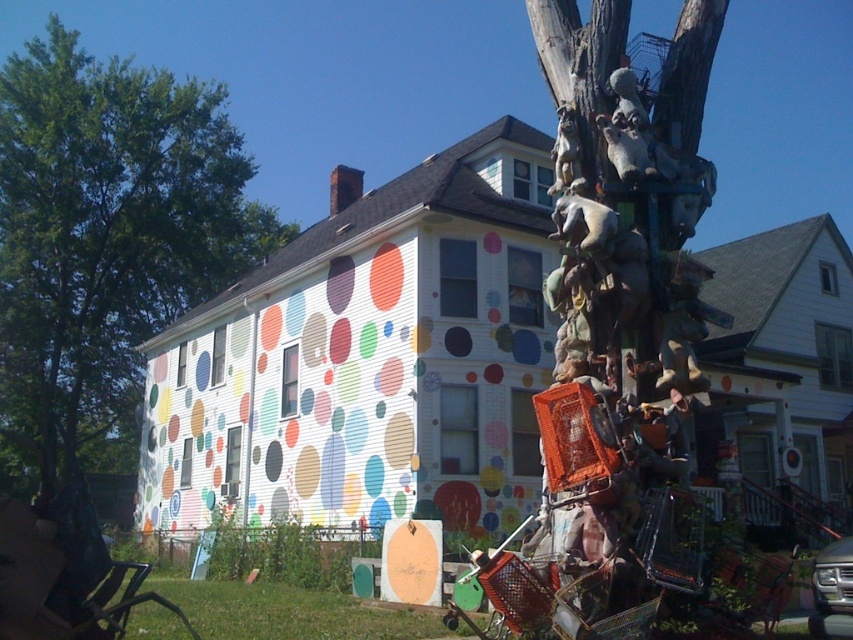
Is green leafy tree at upper left above green grass at lower center?

Yes.

Who is positioned more to the right, green leafy tree at upper left or green grass at lower center?

green grass at lower center

Looking at this image, measure the distance between point (97,164) and camera.

They are 34.40 meters apart.

You are a GUI agent. You are given a task and a screenshot of the screen. Output one action in this format:
    pyautogui.click(x=<x>, y=<y>)
    Task: Click on the green leafy tree at upper left
    This screenshot has height=640, width=853.
    Given the screenshot: What is the action you would take?
    pyautogui.click(x=105, y=241)